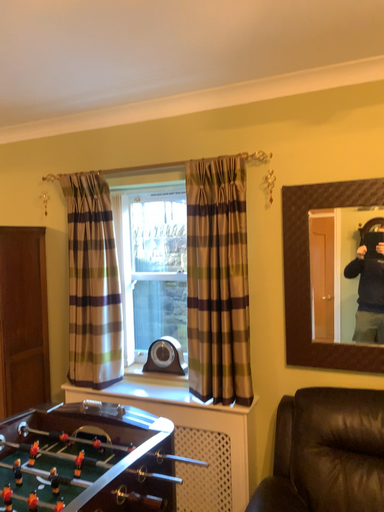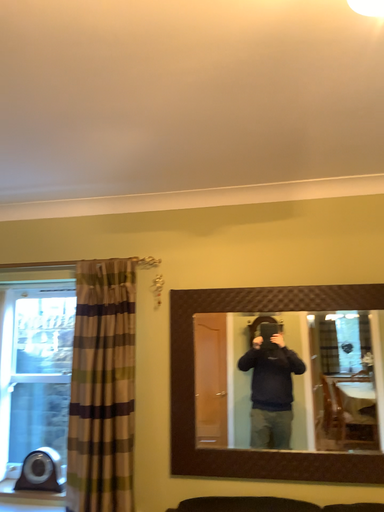
Question: Which way did the camera rotate in the video?

Choices:
 (A) rotated right
 (B) rotated left

Answer: (A)